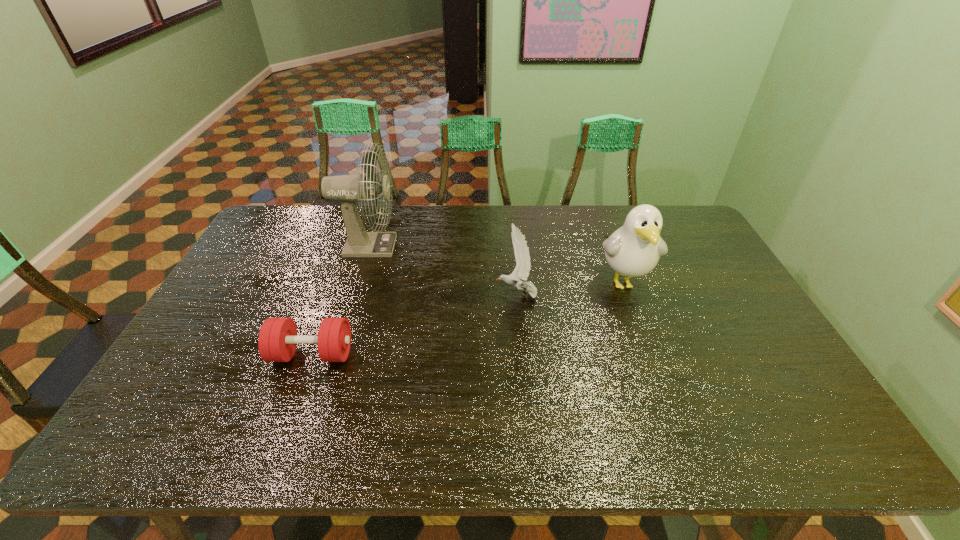
This screenshot has width=960, height=540. In order to click on free point located at the tip of the beak of the shorter gull in this screenshot , I will do `click(406, 295)`.

At what (x,y) coordinates should I click in order to perform the action: click on vacant area situated 0.240m at the tip of the beak of the shorter gull. Please return your answer as a coordinate pair (x, y). Looking at the image, I should click on (416, 295).

You are a GUI agent. You are given a task and a screenshot of the screen. Output one action in this format:
    pyautogui.click(x=<x>, y=<y>)
    Task: Click on the free location located on the front of the shortest object
    This screenshot has width=960, height=540.
    Given the screenshot: What is the action you would take?
    pyautogui.click(x=277, y=450)

The image size is (960, 540). In order to click on object present at the far edge in this screenshot , I will do point(349,189).

The width and height of the screenshot is (960, 540). I want to click on vacant area at the far edge, so click(x=606, y=212).

You are a GUI agent. You are given a task and a screenshot of the screen. Output one action in this format:
    pyautogui.click(x=<x>, y=<y>)
    Task: Click on the blank space at the left edge of the desktop
    
    Given the screenshot: What is the action you would take?
    pyautogui.click(x=180, y=372)

Locate an element on the screen. The image size is (960, 540). vacant space at the near left corner of the desktop is located at coordinates (182, 452).

The height and width of the screenshot is (540, 960). What are the coordinates of `free space at the near right corner of the desktop` in the screenshot? It's located at (806, 434).

The height and width of the screenshot is (540, 960). I want to click on vacant space in between the left gull and the fan, so click(x=443, y=271).

This screenshot has width=960, height=540. I want to click on free space that is in between the fan and the taller gull, so click(x=495, y=264).